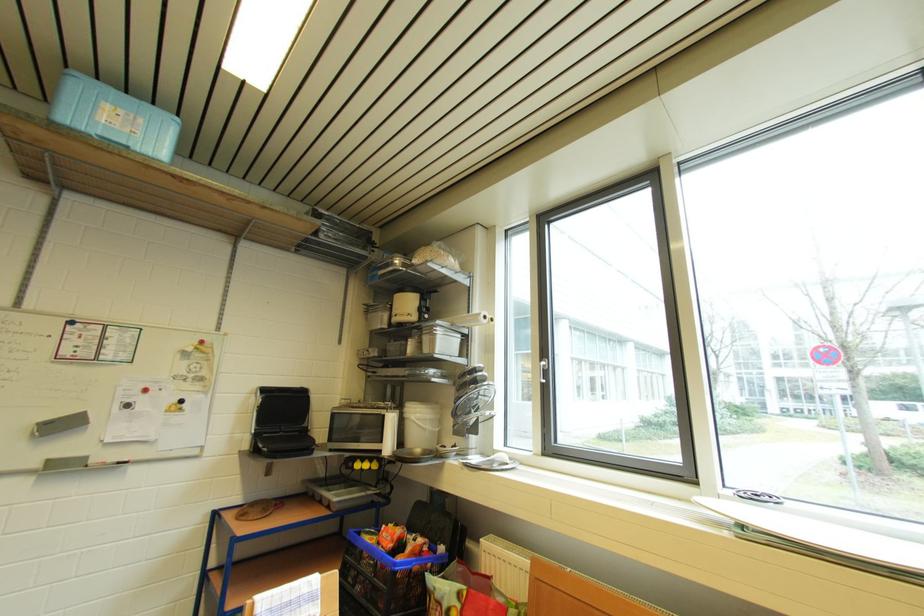
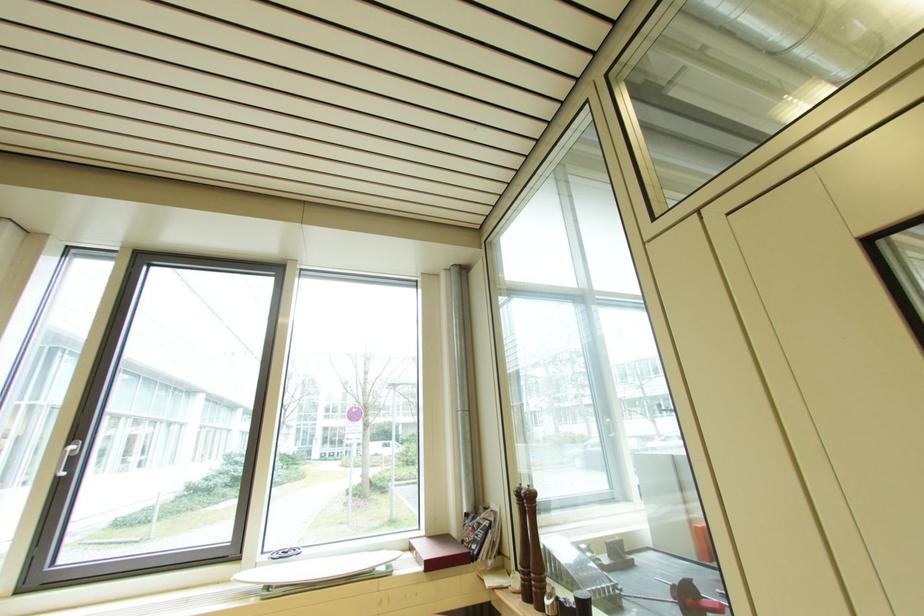
The point at (735, 500) is marked in the first image. Where is the corresponding point in the second image?

(271, 567)